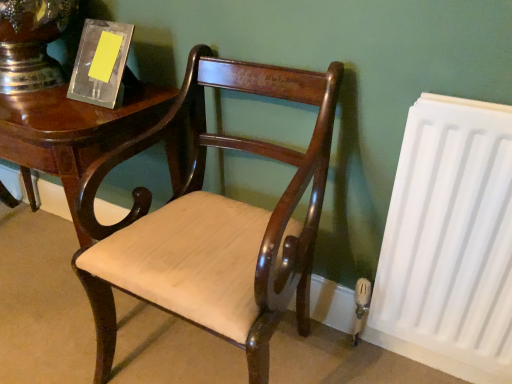
At what (x,y) coordinates should I click in order to perform the action: click on vacant space in between shiny dark wood table at left and mahogany wood chair at center. Please return your answer as a coordinate pair (x, y). The height and width of the screenshot is (384, 512). Looking at the image, I should click on (56, 336).